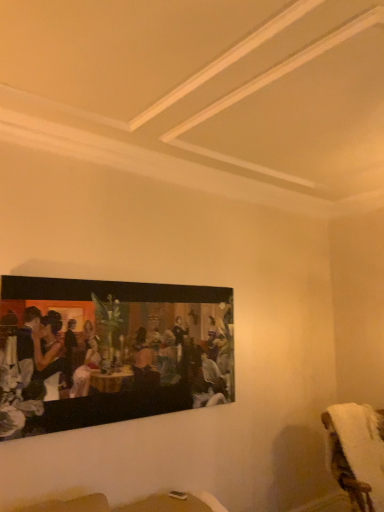
Question: Considering their positions, is white fluffy towel at lower right located in front of or behind matte black painting at upper left?

Choices:
 (A) front
 (B) behind

Answer: (B)

Question: From a real-world perspective, is white fluffy towel at lower right physically located above or below matte black painting at upper left?

Choices:
 (A) above
 (B) below

Answer: (B)

Question: Is white fluffy towel at lower right taller or shorter than matte black painting at upper left?

Choices:
 (A) short
 (B) tall

Answer: (A)

Question: Considering the positions of point (31, 390) and point (342, 483), is point (31, 390) closer or farther from the camera than point (342, 483)?

Choices:
 (A) closer
 (B) farther

Answer: (A)

Question: Visually, is matte black painting at upper left positioned to the left or to the right of white fluffy towel at lower right?

Choices:
 (A) right
 (B) left

Answer: (B)

Question: Considering their positions, is matte black painting at upper left located in front of or behind white fluffy towel at lower right?

Choices:
 (A) front
 (B) behind

Answer: (A)

Question: Is matte black painting at upper left bigger or smaller than white fluffy towel at lower right?

Choices:
 (A) small
 (B) big

Answer: (A)